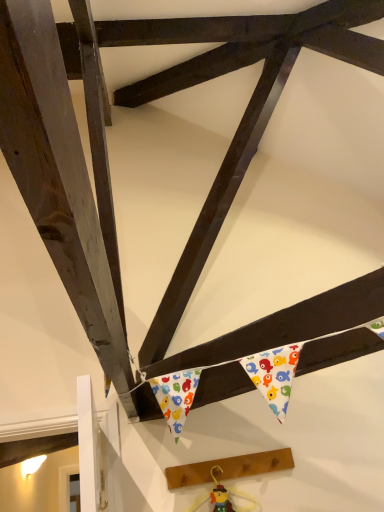
Question: Is point (236, 460) positioned closer to the camera than point (235, 496)?

Choices:
 (A) closer
 (B) farther

Answer: (B)

Question: Based on their positions, is wooden plank at lower center located to the left or right of wooden toy at center?

Choices:
 (A) left
 (B) right

Answer: (B)

Question: Considering their positions, is wooden plank at lower center located in front of or behind wooden toy at center?

Choices:
 (A) behind
 (B) front

Answer: (A)

Question: From their relative heights in the image, would you say wooden toy at center is taller or shorter than wooden plank at lower center?

Choices:
 (A) tall
 (B) short

Answer: (A)

Question: Does point 211,468 appear closer or farther from the camera than point 215,474?

Choices:
 (A) closer
 (B) farther

Answer: (B)

Question: Considering the positions of wooden toy at center and wooden plank at lower center in the image, is wooden toy at center wider or thinner than wooden plank at lower center?

Choices:
 (A) wide
 (B) thin

Answer: (B)

Question: Would you say wooden toy at center is to the left or to the right of wooden plank at lower center in the picture?

Choices:
 (A) left
 (B) right

Answer: (A)